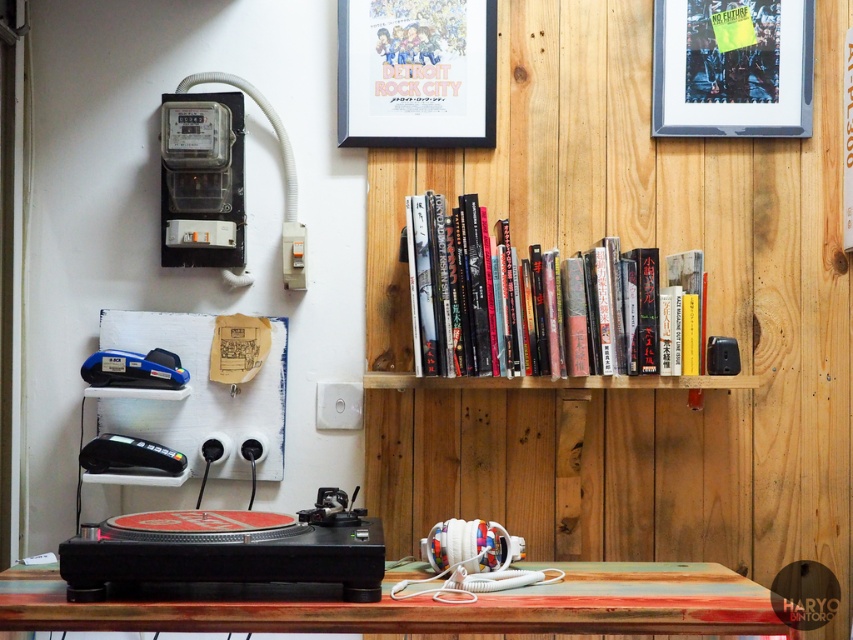
Question: Which of the following is the closest to the observer?

Choices:
 (A) rustic wood table at lower center
 (B) hardcover books at center
 (C) wooden bookshelf at upper center
 (D) black plastic credit card reader at lower left

Answer: (A)

Question: Does matte paper poster at upper center have a lesser width compared to metallic gray meter at upper left?

Choices:
 (A) no
 (B) yes

Answer: (A)

Question: Which of the following is the farthest from the observer?

Choices:
 (A) (643, 620)
 (B) (657, 81)
 (C) (171, 104)
 (D) (149, 371)

Answer: (B)

Question: Is rustic wood table at lower center below metallic gray meter at upper left?

Choices:
 (A) no
 (B) yes

Answer: (B)

Question: Considering the relative positions of hardcover books at center and metallic gray meter at upper left in the image provided, where is hardcover books at center located with respect to metallic gray meter at upper left?

Choices:
 (A) below
 (B) above

Answer: (A)

Question: Which point is farther from the camera taking this photo?

Choices:
 (A) [592, 628]
 (B) [846, 628]
 (C) [540, 282]

Answer: (B)